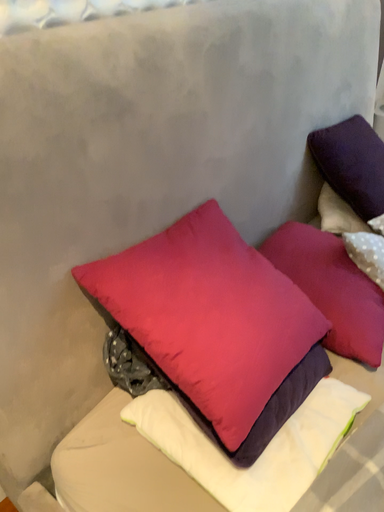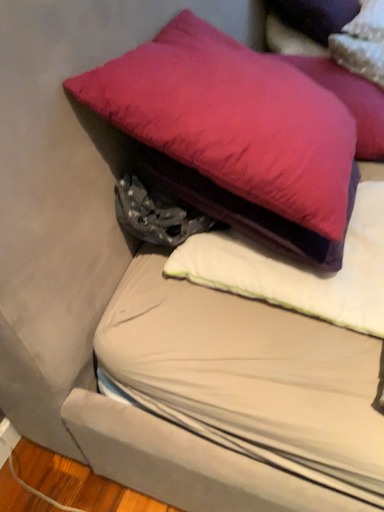
Question: Which way did the camera rotate in the video?

Choices:
 (A) rotated left
 (B) rotated right

Answer: (B)